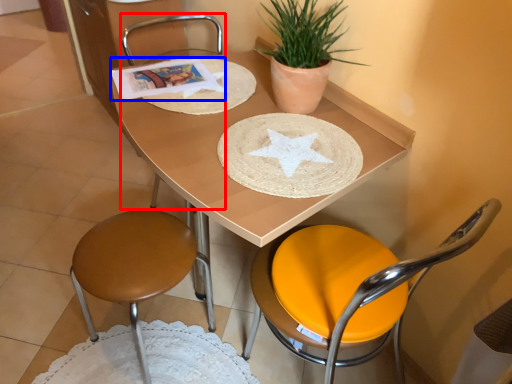
Question: Which object appears farthest to the camera in this image, chair (highlighted by a red box) or magazine (highlighted by a blue box)?

Choices:
 (A) chair
 (B) magazine

Answer: (A)